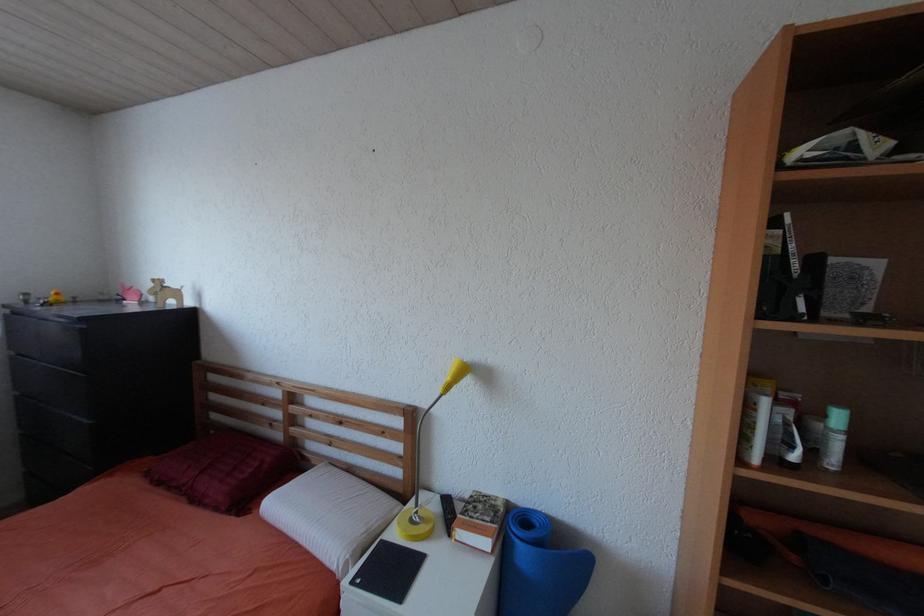
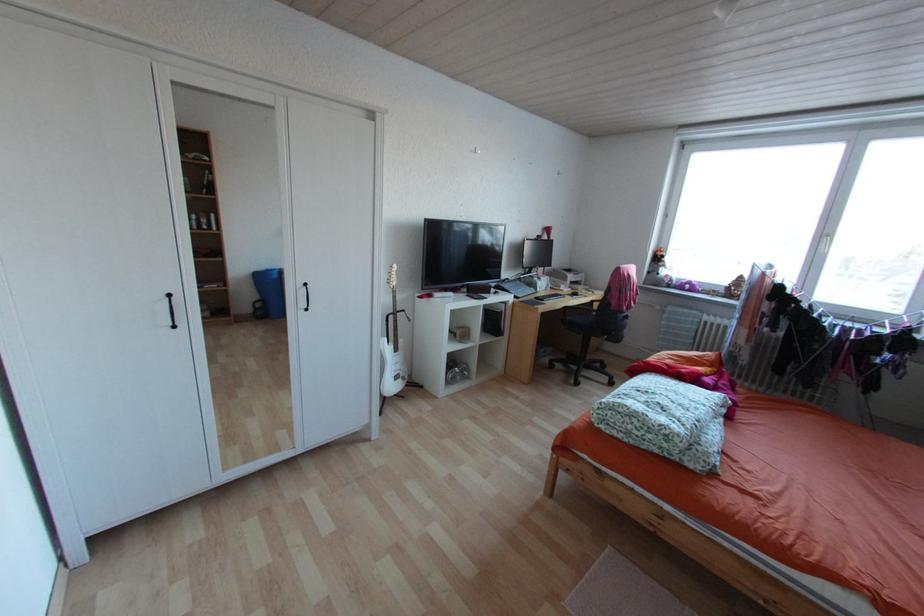
The first image is from the beginning of the video and the second image is from the end. How did the camera likely rotate when shooting the video?

The camera's rotation is toward left-down.